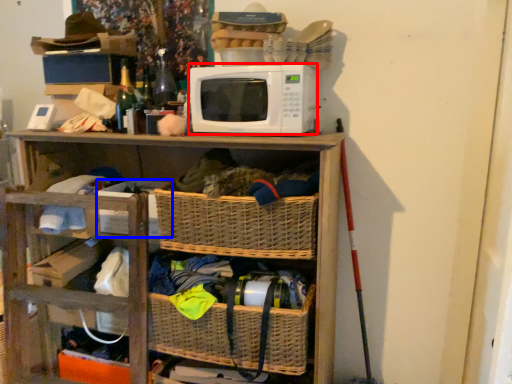
Question: Which object is closer to the camera taking this photo, microwave oven (highlighted by a red box) or storage box (highlighted by a blue box)?

Choices:
 (A) microwave oven
 (B) storage box

Answer: (A)